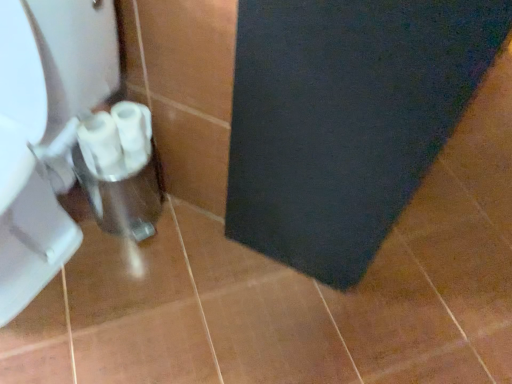
Question: From the image's perspective, would you say white plastic toilet paper at lower left, which is the 1th toilet paper in right-to-left order, is positioned over white glossy toilet paper at lower left, the first toilet paper when ordered from left to right?

Choices:
 (A) no
 (B) yes

Answer: (B)

Question: Considering the relative positions of white plastic toilet paper at lower left, which is the 1th toilet paper in right-to-left order, and white glossy toilet paper at lower left, the second toilet paper in the right-to-left sequence, in the image provided, is white plastic toilet paper at lower left, which is the 1th toilet paper in right-to-left order, to the right of white glossy toilet paper at lower left, the second toilet paper in the right-to-left sequence, from the viewer's perspective?

Choices:
 (A) no
 (B) yes

Answer: (B)

Question: Can you confirm if white plastic toilet paper at lower left, which is the 1th toilet paper in right-to-left order, is wider than white glossy toilet paper at lower left, the second toilet paper in the right-to-left sequence?

Choices:
 (A) yes
 (B) no

Answer: (B)

Question: Can you confirm if white plastic toilet paper at lower left, the 2th toilet paper in the left-to-right sequence, is thinner than white glossy toilet paper at lower left, the first toilet paper when ordered from left to right?

Choices:
 (A) no
 (B) yes

Answer: (B)

Question: Is white plastic toilet paper at lower left, the 2th toilet paper in the left-to-right sequence, positioned with its back to white glossy toilet paper at lower left, the second toilet paper in the right-to-left sequence?

Choices:
 (A) no
 (B) yes

Answer: (A)

Question: Is white plastic toilet paper at lower left, the 2th toilet paper in the left-to-right sequence, situated inside dark blue felt bath mat at lower right or outside?

Choices:
 (A) inside
 (B) outside

Answer: (B)

Question: Is white plastic toilet paper at lower left, the 2th toilet paper in the left-to-right sequence, in front of or behind dark blue felt bath mat at lower right in the image?

Choices:
 (A) front
 (B) behind

Answer: (B)

Question: Is white plastic toilet paper at lower left, the 2th toilet paper in the left-to-right sequence, taller or shorter than dark blue felt bath mat at lower right?

Choices:
 (A) short
 (B) tall

Answer: (A)

Question: Is white plastic toilet paper at lower left, the 2th toilet paper in the left-to-right sequence, bigger or smaller than dark blue felt bath mat at lower right?

Choices:
 (A) small
 (B) big

Answer: (A)

Question: Looking at the image, does white plastic toilet paper at lower left, the 2th toilet paper in the left-to-right sequence, seem bigger or smaller compared to white glossy toilet at left?

Choices:
 (A) big
 (B) small

Answer: (B)

Question: Considering the positions of point (143, 160) and point (32, 137), is point (143, 160) closer or farther from the camera than point (32, 137)?

Choices:
 (A) farther
 (B) closer

Answer: (A)

Question: Based on their positions, is white plastic toilet paper at lower left, which is the 1th toilet paper in right-to-left order, located to the left or right of white glossy toilet at left?

Choices:
 (A) left
 (B) right

Answer: (B)

Question: Considering the positions of white plastic toilet paper at lower left, which is the 1th toilet paper in right-to-left order, and white glossy toilet at left in the image, is white plastic toilet paper at lower left, which is the 1th toilet paper in right-to-left order, taller or shorter than white glossy toilet at left?

Choices:
 (A) short
 (B) tall

Answer: (A)

Question: Is point (78, 130) closer or farther from the camera than point (141, 142)?

Choices:
 (A) farther
 (B) closer

Answer: (B)

Question: Is white glossy toilet paper at lower left, the first toilet paper when ordered from left to right, wider or thinner than white plastic toilet paper at lower left, which is the 1th toilet paper in right-to-left order?

Choices:
 (A) wide
 (B) thin

Answer: (A)